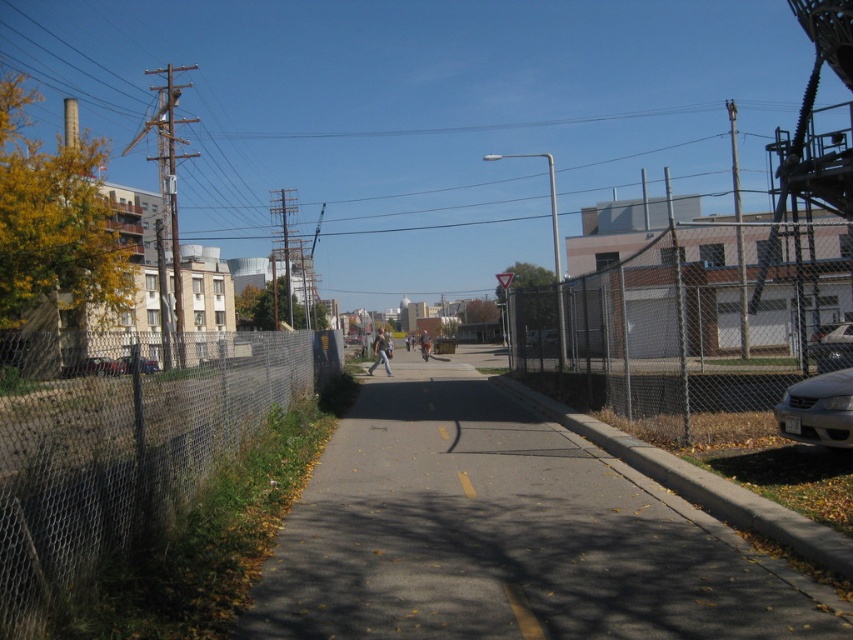
Who is positioned more to the left, gray asphalt pavement at center or white glossy sedan at right?

Positioned to the left is gray asphalt pavement at center.

Does gray asphalt pavement at center appear under white glossy sedan at right?

Yes.

The width and height of the screenshot is (853, 640). What do you see at coordinates (508, 536) in the screenshot?
I see `gray asphalt pavement at center` at bounding box center [508, 536].

The image size is (853, 640). In order to click on gray asphalt pavement at center in this screenshot , I will do [508, 536].

Can you confirm if chain-link fence at right is bigger than light blue jeans at center?

Indeed, chain-link fence at right has a larger size compared to light blue jeans at center.

Which is in front, point (660, 353) or point (387, 365)?

Point (660, 353) is more forward.

What are the coordinates of `chain-link fence at right` in the screenshot? It's located at (688, 326).

I want to click on chain-link fence at right, so click(x=688, y=326).

Does gray asphalt pavement at center have a lesser width compared to silver metallic sedan at right?

No.

This screenshot has height=640, width=853. Find the location of `gray asphalt pavement at center`. gray asphalt pavement at center is located at coordinates (508, 536).